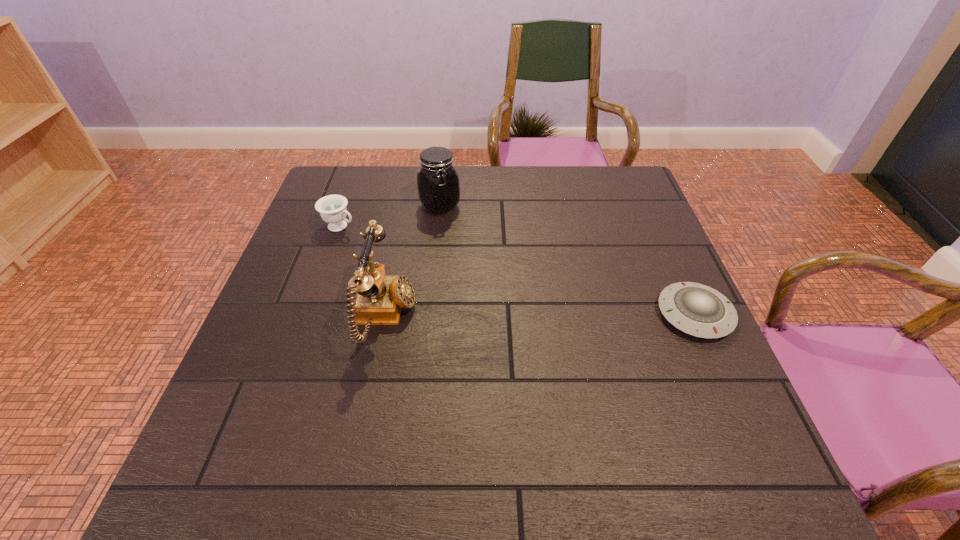
Find the location of a particular element. telephone is located at coordinates (379, 298).

You are a GUI agent. You are given a task and a screenshot of the screen. Output one action in this format:
    pyautogui.click(x=<x>, y=<y>)
    Task: Click on the rightmost object
    
    Given the screenshot: What is the action you would take?
    pyautogui.click(x=696, y=309)

Where is `the shortest object`? The width and height of the screenshot is (960, 540). the shortest object is located at coordinates (696, 309).

The width and height of the screenshot is (960, 540). What are the coordinates of `the leftmost object` in the screenshot? It's located at (332, 208).

Identify the location of the third tallest object. The height and width of the screenshot is (540, 960). (332, 208).

This screenshot has width=960, height=540. Find the location of `jar`. jar is located at coordinates (438, 185).

Find the location of a particular element. blank area located 0.150m on the dial number of the telephone is located at coordinates (480, 316).

Locate an element on the screen. Image resolution: width=960 pixels, height=540 pixels. free space located on the front of the rightmost object is located at coordinates (743, 423).

Identify the location of vacant area located 0.290m on the side of the teacup with the handle. This screenshot has height=540, width=960. (438, 271).

This screenshot has width=960, height=540. Find the location of `free spot located on the side of the teacup with the handle`. free spot located on the side of the teacup with the handle is located at coordinates (425, 265).